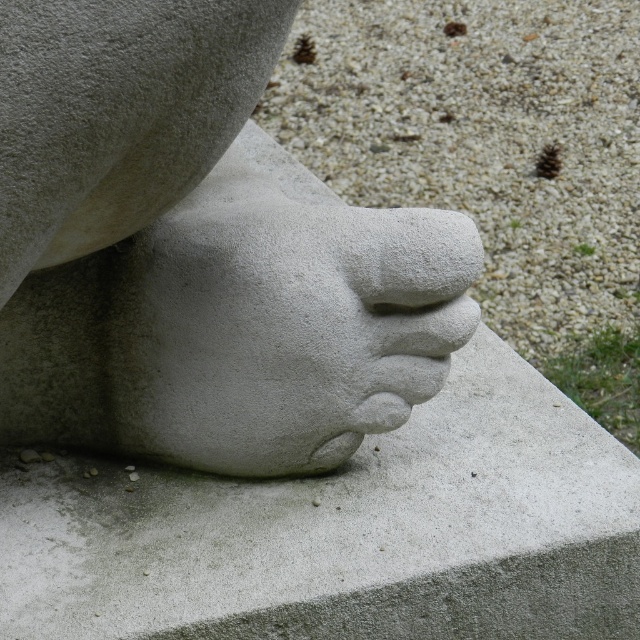
You are an art conservator examining the stone sculpture. You notice two points on the sculpture marked at coordinates point (164, 616) and point (442, 237). Which point is nearer to your vantage point as you stand in front of the sculpture?

Point (164, 616) is closer to the viewer than point (442, 237).

You are an art conservator examining the stone sculpture. You notice the gray stone sculpture at center and the white stone hand at center. Which object is located above the other?

The white stone hand at center is above the gray stone sculpture at center because the gray stone sculpture at center is positioned under the white stone hand at center.

You are an art conservator examining the sculpture. You notice two white stone parts at the center. Which one is positioned closer to you, the white stone foot at center or the white stone hand at center?

The white stone foot at center is closer to the viewer than the white stone hand at center.